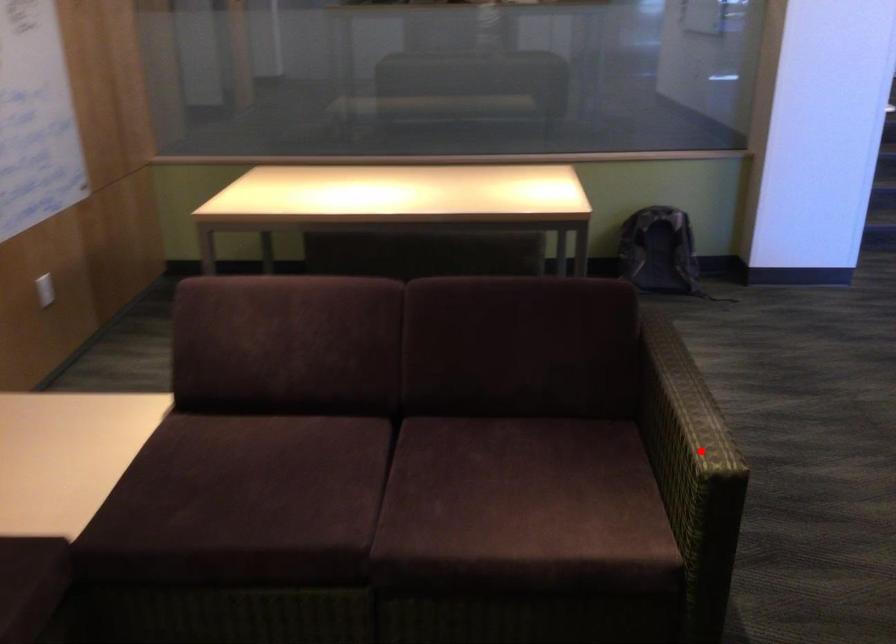
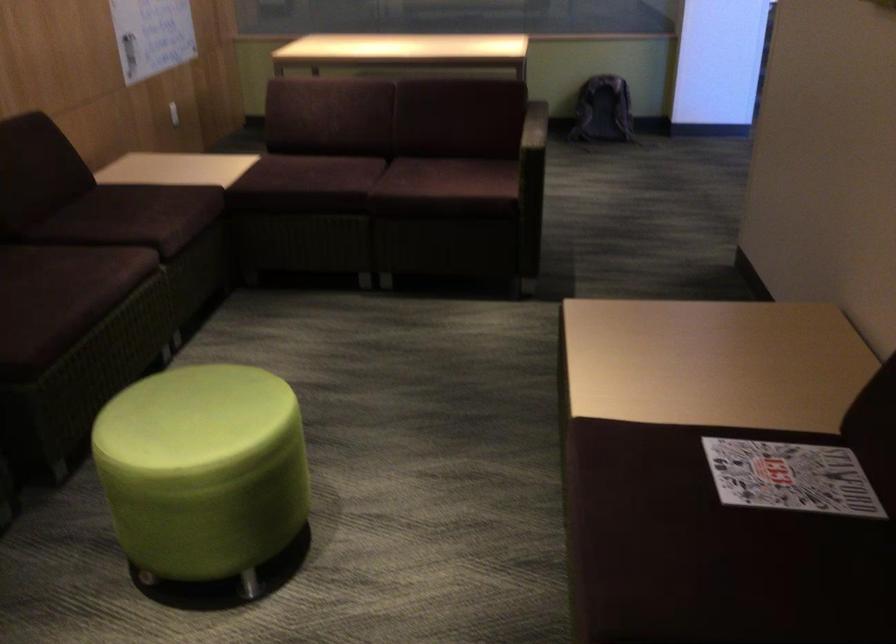
In the second image, find the point that corresponds to the highlighted location in the first image.

(533, 138)